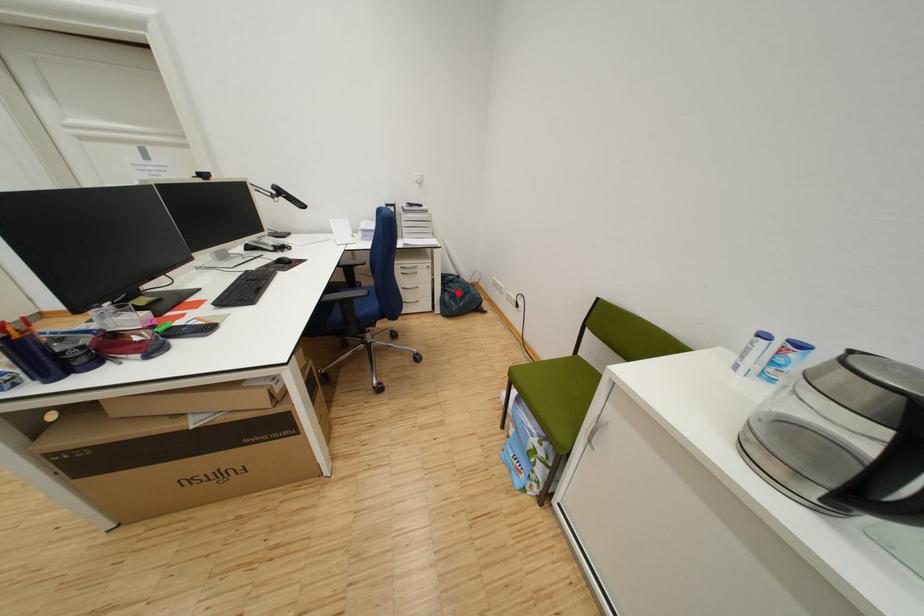
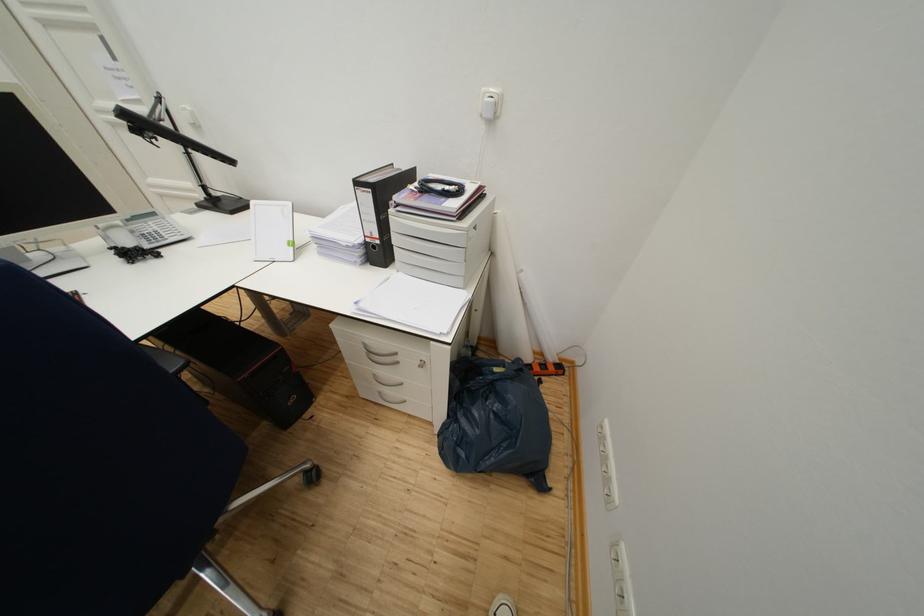
In the second image, find the point that corresponds to the highlighted location in the first image.

(468, 423)